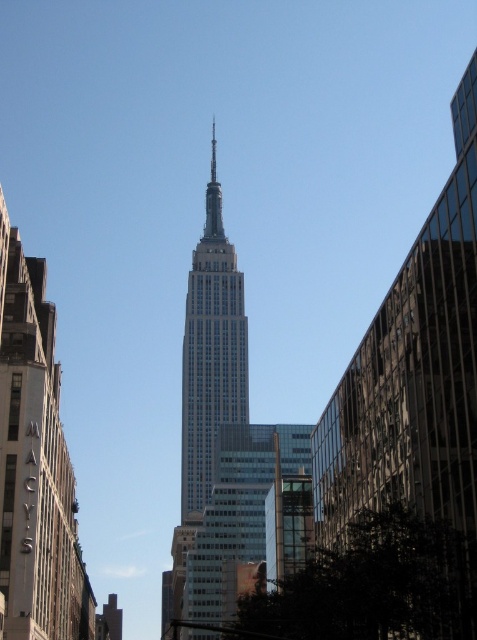
Which of these two, matte glass skyscraper at center or white glass building at center, stands taller?

white glass building at center

Does point (41, 531) come behind point (195, 461)?

No, it is not.

I want to click on matte glass skyscraper at center, so (x=34, y=461).

Does glassy reflective skyscraper at center have a lesser height compared to matte glass skyscraper at center?

Yes, glassy reflective skyscraper at center is shorter than matte glass skyscraper at center.

Describe the element at coordinates (414, 381) in the screenshot. I see `glassy reflective skyscraper at center` at that location.

This screenshot has width=477, height=640. Describe the element at coordinates (414, 381) in the screenshot. I see `glassy reflective skyscraper at center` at that location.

Find the location of a particular element. The width and height of the screenshot is (477, 640). glassy reflective skyscraper at center is located at coordinates (414, 381).

Between point (412, 454) and point (197, 436), which one is positioned in front?

Point (412, 454) is in front.

Who is higher up, glassy reflective skyscraper at center or white glass building at center?

glassy reflective skyscraper at center is higher up.

Locate an element on the screen. glassy reflective skyscraper at center is located at coordinates (414, 381).

Locate an element on the screen. The width and height of the screenshot is (477, 640). glassy reflective skyscraper at center is located at coordinates (414, 381).